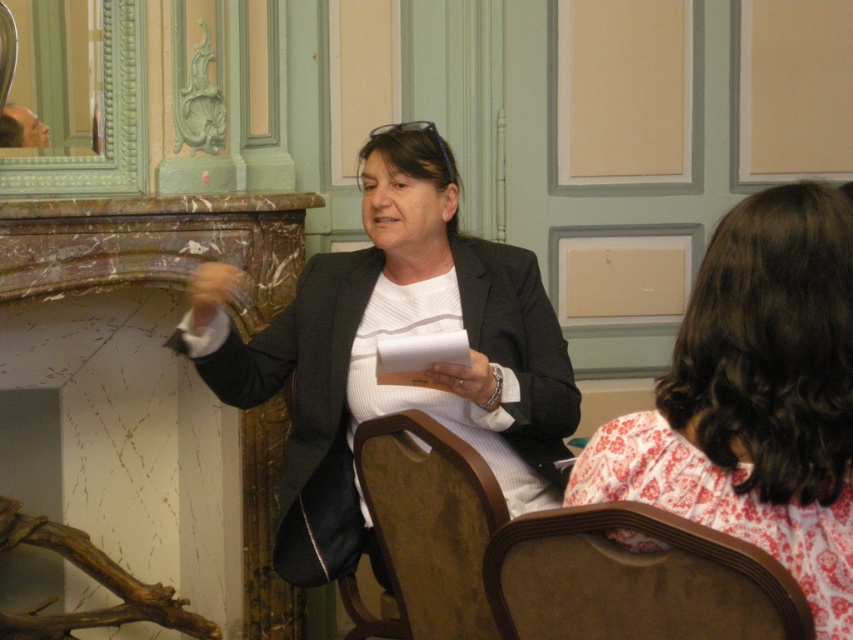
You are standing at the center of the room and want to move to the beige fabric armchair at lower right. Which direction should you move in?

The beige fabric armchair at lower right is located at point (635, 580), so you should move towards the lower right direction to reach it.

You are an interior designer analyzing the spatial arrangement of the room. You notice the matte black blazer at center and the brown wood chair at center. Which object is closer to the viewer?

The matte black blazer at center is closer to the viewer than the brown wood chair at center.

In the scene shown: You are standing in the room and want to place a small decoration between the two points, point (527, 435) and point (456, 582). Which point is closer to you so that you can reach it first?

Point (527, 435) is further to the viewer than point (456, 582), so the point closer to you is point (456, 582). You can reach it first.